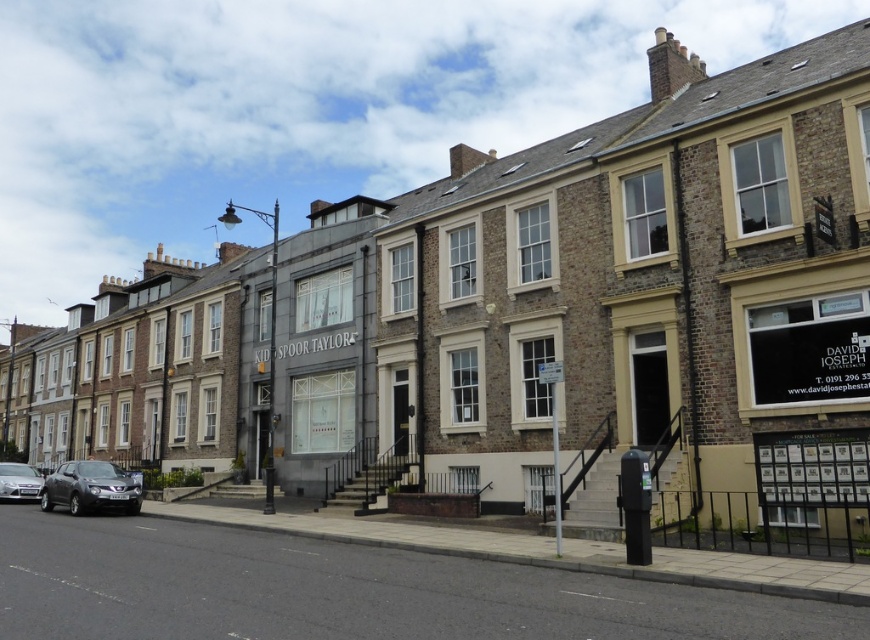
You are a delivery person trying to park your van between the matte black suv at lower left and the silver metallic car at lower left. Can you fit your van there?

The matte black suv at lower left is positioned under the silver metallic car at lower left, meaning there is no space between them for the van to fit.

You are standing on the sidewalk in front of the row of brick buildings and want to walk towards the two points marked in the image. Which point, point (75, 468) or point (39, 490), will you reach first?

You will reach point (75, 468) first because it is closer to the viewer than point (39, 490).

You are standing at the corner of the street and want to locate the matte black suv at lower left. According to the coordinates, where exactly is it positioned?

The matte black suv at lower left is located at coordinates point (90, 486).